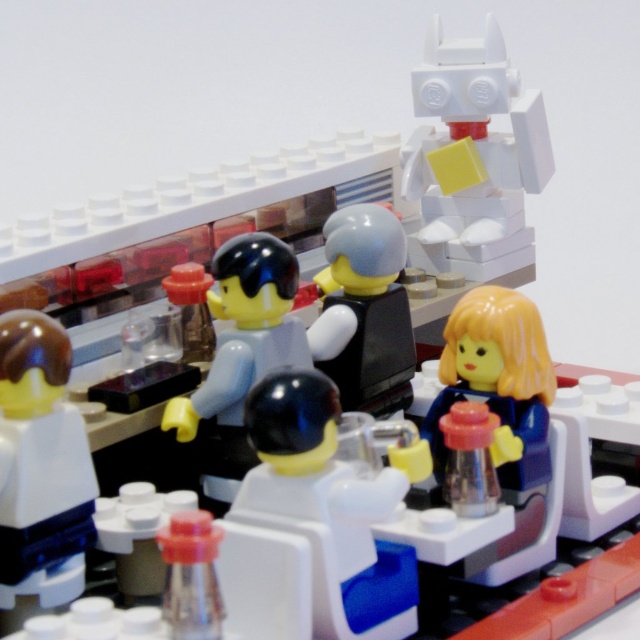
Question: Where is smooth yellow hair at center located in relation to smooth black vest at center in the image?

Choices:
 (A) above
 (B) below

Answer: (B)

Question: Is white plastic figure at center above smooth yellow hair at center?

Choices:
 (A) yes
 (B) no

Answer: (B)

Question: Which object is the farthest from the white plastic figure at center?

Choices:
 (A) white matte robot at upper right
 (B) smooth black vest at center
 (C) smooth white torso at center

Answer: (A)

Question: Which object appears farthest from the camera in this image?

Choices:
 (A) translucent blue plastic figure at center
 (B) smooth white torso at center
 (C) smooth yellow hair at center

Answer: (A)

Question: Which object is closer to the camera taking this photo?

Choices:
 (A) smooth yellow hair at center
 (B) smooth white torso at center

Answer: (B)

Question: Does smooth white torso at center appear on the left side of smooth yellow hair at center?

Choices:
 (A) no
 (B) yes

Answer: (B)